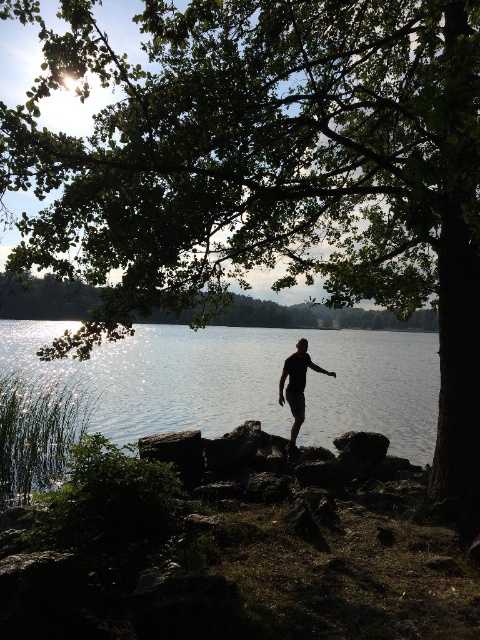
Question: Which object is closer to the camera taking this photo?

Choices:
 (A) clear water at center
 (B) black matte shorts at center

Answer: (B)

Question: In this image, where is clear water at center located relative to black matte shorts at center?

Choices:
 (A) right
 (B) left

Answer: (B)

Question: Can you confirm if clear water at center is positioned above black matte shorts at center?

Choices:
 (A) yes
 (B) no

Answer: (A)

Question: Which point is closer to the camera?

Choices:
 (A) black matte shorts at center
 (B) clear water at center

Answer: (A)

Question: Can you confirm if clear water at center is positioned above black matte shorts at center?

Choices:
 (A) yes
 (B) no

Answer: (A)